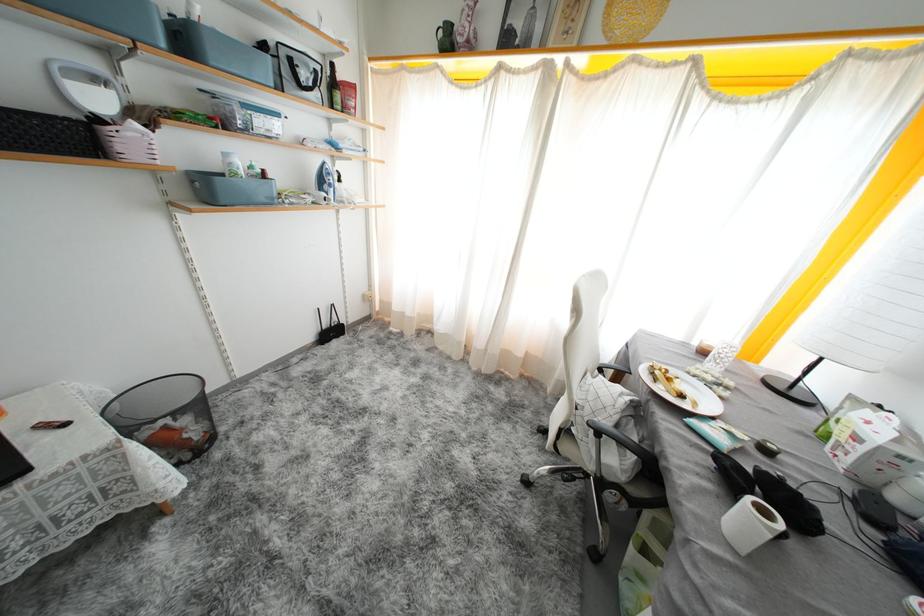
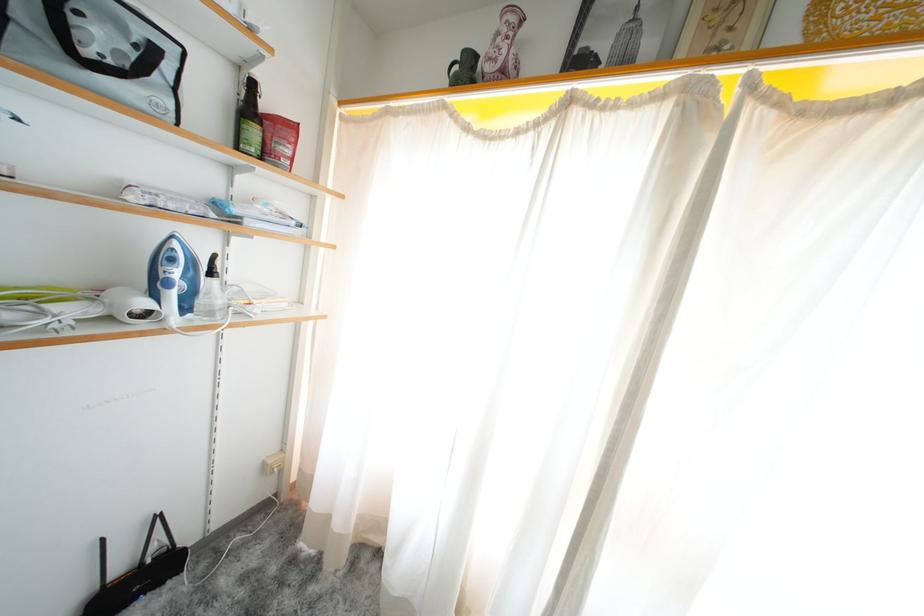
Find the pixel in the second image that matches point (331, 167) in the first image.

(178, 241)